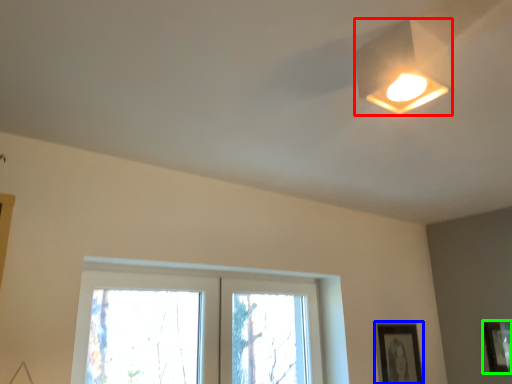
Question: Estimate the real-world distances between objects in this image. Which object is farther from lamp (highlighted by a red box), picture frame (highlighted by a blue box) or picture frame (highlighted by a green box)?

Choices:
 (A) picture frame
 (B) picture frame

Answer: (B)